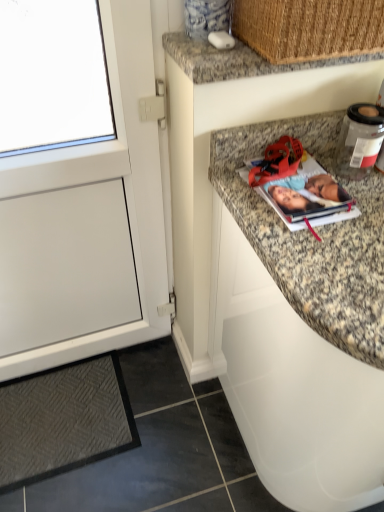
Locate an element on the screen. vacant area that lies between white matte cabinet at left, which is counted as the 2th cabinetry, starting from the right, and dark gray textured mat at lower left is located at coordinates (154, 382).